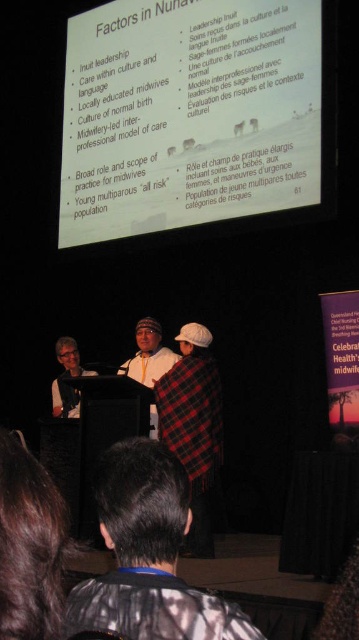
Does white matte projector screen at upper center appear on the right side of dark gray jacket at lower center?

Indeed, white matte projector screen at upper center is positioned on the right side of dark gray jacket at lower center.

Consider the image. Could you measure the distance between white matte projector screen at upper center and dark gray jacket at lower center?

white matte projector screen at upper center is 11.22 meters from dark gray jacket at lower center.

Which is behind, point (179, 92) or point (147, 486)?

The point (179, 92) is more distant.

Where is `white matte projector screen at upper center`? white matte projector screen at upper center is located at coordinates (196, 115).

Can you confirm if plaid fabric blanket at center is positioned to the left of plaid fabric hat at center?

In fact, plaid fabric blanket at center is to the right of plaid fabric hat at center.

Consider the image. Is plaid fabric blanket at center thinner than plaid fabric hat at center?

Indeed, plaid fabric blanket at center has a lesser width compared to plaid fabric hat at center.

What do you see at coordinates (193, 426) in the screenshot? The width and height of the screenshot is (359, 640). I see `plaid fabric blanket at center` at bounding box center [193, 426].

Where is `plaid fabric blanket at center`? This screenshot has height=640, width=359. plaid fabric blanket at center is located at coordinates (193, 426).

Where is `white matte projector screen at upper center`? Image resolution: width=359 pixels, height=640 pixels. white matte projector screen at upper center is located at coordinates (x=196, y=115).

Identify the location of white matte projector screen at upper center. The width and height of the screenshot is (359, 640). (196, 115).